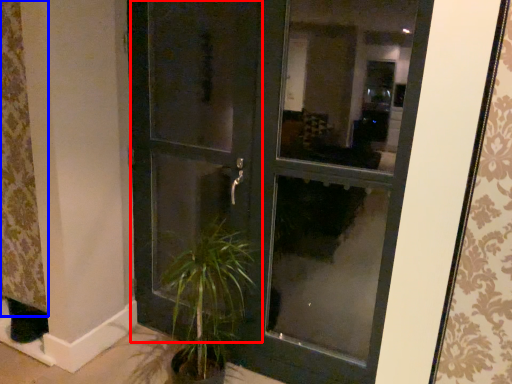
Question: Which object appears farthest to the camera in this image, screen door (highlighted by a red box) or curtain (highlighted by a blue box)?

Choices:
 (A) screen door
 (B) curtain

Answer: (B)